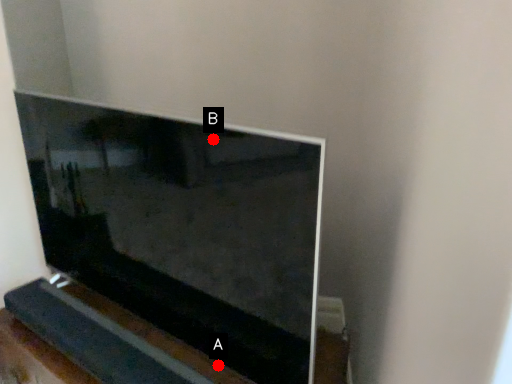
Question: Two points are circled on the image, labeled by A and B beside each circle. Which point is closer to the camera?

Choices:
 (A) A is closer
 (B) B is closer

Answer: (B)